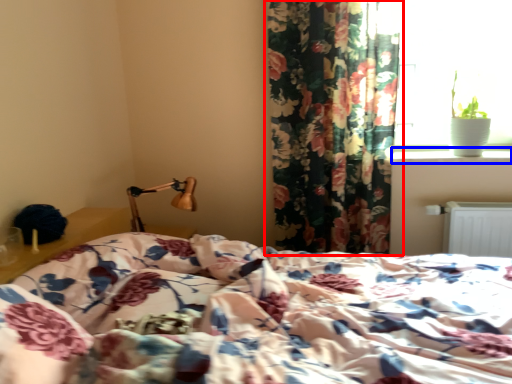
Question: Which of the following is the closest to the observer, curtain (highlighted by a red box) or window sill (highlighted by a blue box)?

Choices:
 (A) curtain
 (B) window sill

Answer: (A)